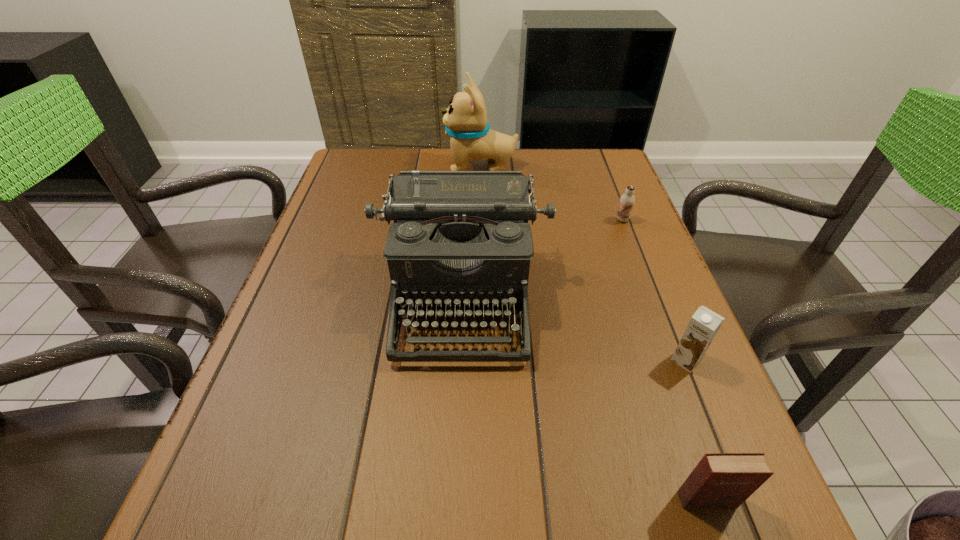
Find the location of a particular element. The image size is (960, 540). vacant space located on the left of the nearer chocolate milk is located at coordinates (551, 360).

Identify the location of vacant space situated 0.340m on the front of the second farthest object. This screenshot has height=540, width=960. (662, 324).

Where is `object at the far edge`? This screenshot has height=540, width=960. object at the far edge is located at coordinates (465, 119).

At what (x,y) coordinates should I click in order to perform the action: click on object situated at the near edge. Please return your answer as a coordinate pair (x, y). This screenshot has width=960, height=540. Looking at the image, I should click on (720, 480).

This screenshot has width=960, height=540. I want to click on diary located at the right edge, so click(x=720, y=480).

Image resolution: width=960 pixels, height=540 pixels. I want to click on object present at the near right corner, so click(720, 480).

Where is `vacant space at the far edge of the desktop`? The height and width of the screenshot is (540, 960). vacant space at the far edge of the desktop is located at coordinates (408, 163).

The image size is (960, 540). Find the location of `vacant space at the near edge`. vacant space at the near edge is located at coordinates (588, 525).

The height and width of the screenshot is (540, 960). Identify the location of blank space at the left edge of the desktop. (337, 309).

In the image, there is a desktop. Where is `free region at the right edge`? The width and height of the screenshot is (960, 540). free region at the right edge is located at coordinates (741, 452).